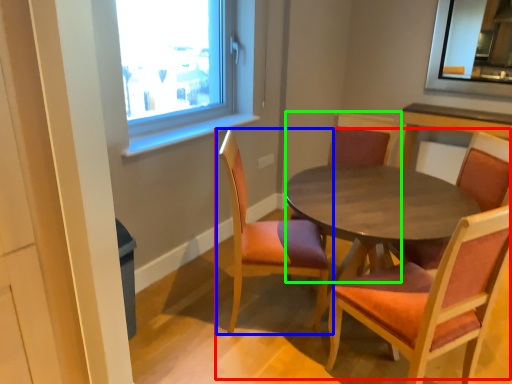
Question: Considering the real-world distances, which object is closest to kitchen & dining room table (highlighted by a red box)? chair (highlighted by a blue box) or chair (highlighted by a green box).

Choices:
 (A) chair
 (B) chair

Answer: (A)